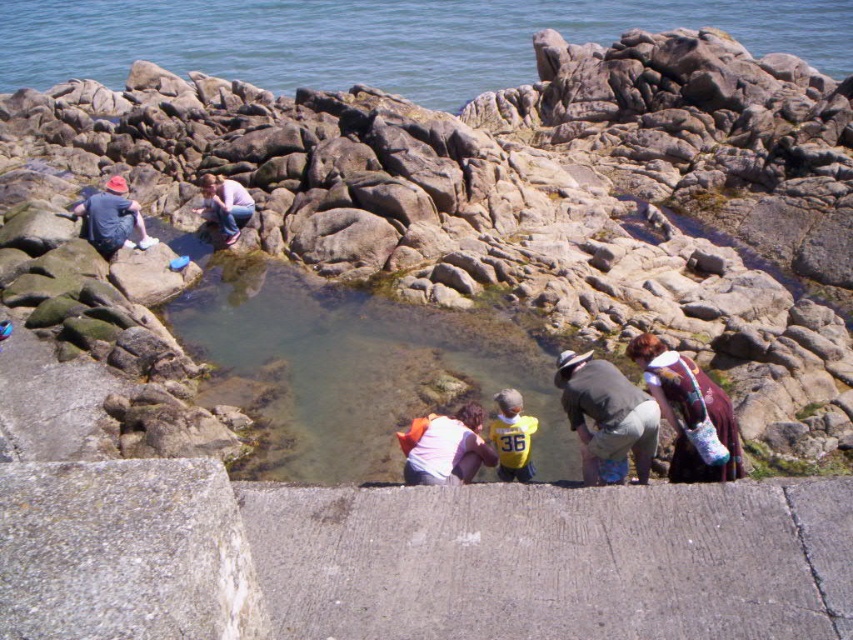
Is knitted sweater at lower right bigger than matte blue jeans at upper center?

Correct, knitted sweater at lower right is larger in size than matte blue jeans at upper center.

Which is above, knitted sweater at lower right or matte blue jeans at upper center?

matte blue jeans at upper center is higher up.

What do you see at coordinates (689, 413) in the screenshot?
I see `knitted sweater at lower right` at bounding box center [689, 413].

Image resolution: width=853 pixels, height=640 pixels. Find the location of `knitted sweater at lower right`. knitted sweater at lower right is located at coordinates (689, 413).

Does rocky at center have a smaller size compared to matte blue shirt at left?

Actually, rocky at center might be larger than matte blue shirt at left.

Can you confirm if rocky at center is positioned below matte blue shirt at left?

Incorrect, rocky at center is not positioned below matte blue shirt at left.

What do you see at coordinates (526, 193) in the screenshot? I see `rocky at center` at bounding box center [526, 193].

You are a GUI agent. You are given a task and a screenshot of the screen. Output one action in this format:
    pyautogui.click(x=<x>, y=<y>)
    Task: Click on the rocky at center
    
    Given the screenshot: What is the action you would take?
    pyautogui.click(x=526, y=193)

Can you confirm if matte pink shirt at center is thinner than matte blue shirt at left?

Yes.

Is point (456, 480) positioned before point (78, 212)?

That is True.

Who is more distant from viewer, [408,454] or [90,230]?

Point [90,230]

Locate an element on the screen. matte pink shirt at center is located at coordinates (445, 448).